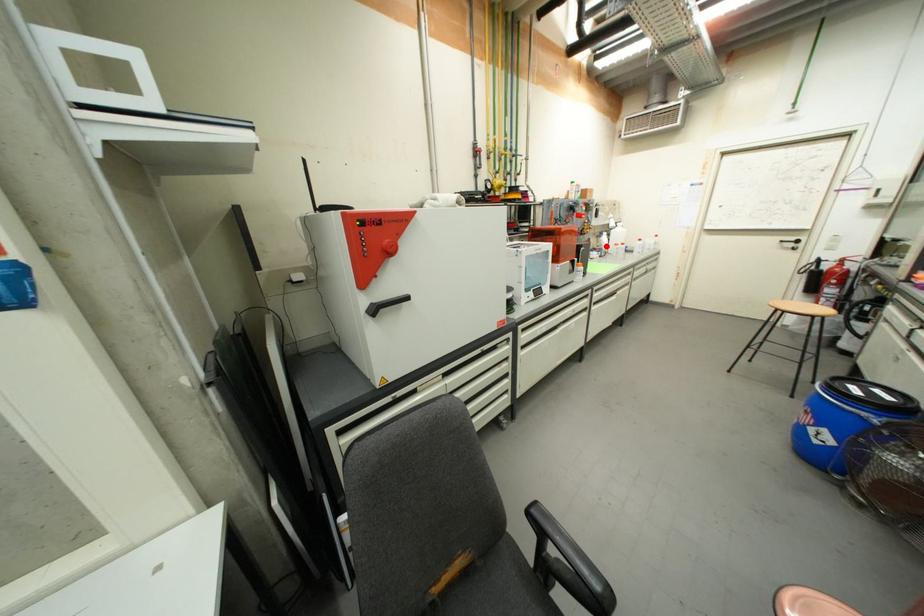
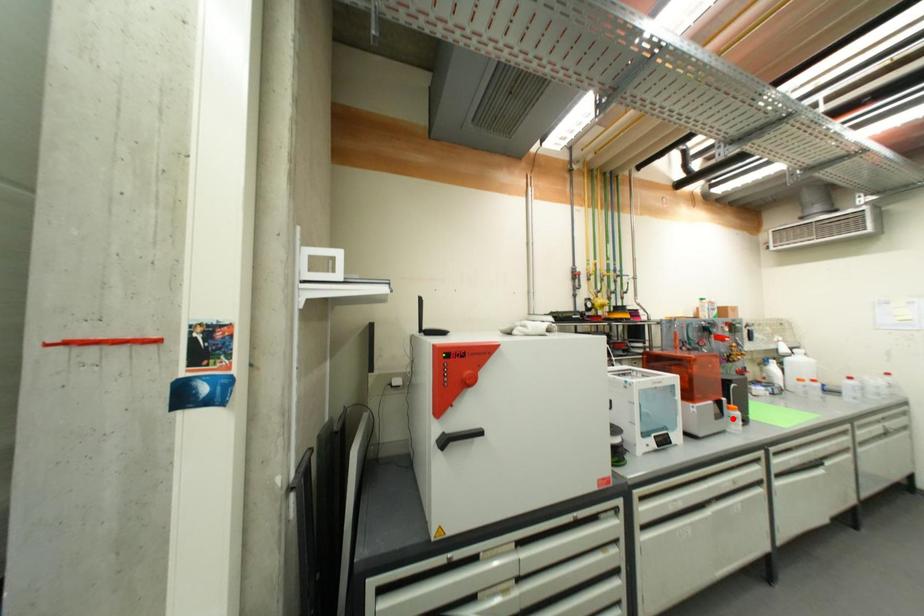
I am providing you with two images of the same scene from different viewpoints. A red point is marked on the first image and another point is marked on the second image. Is the red point in image1 aligned with the point shown in image2?

A: No